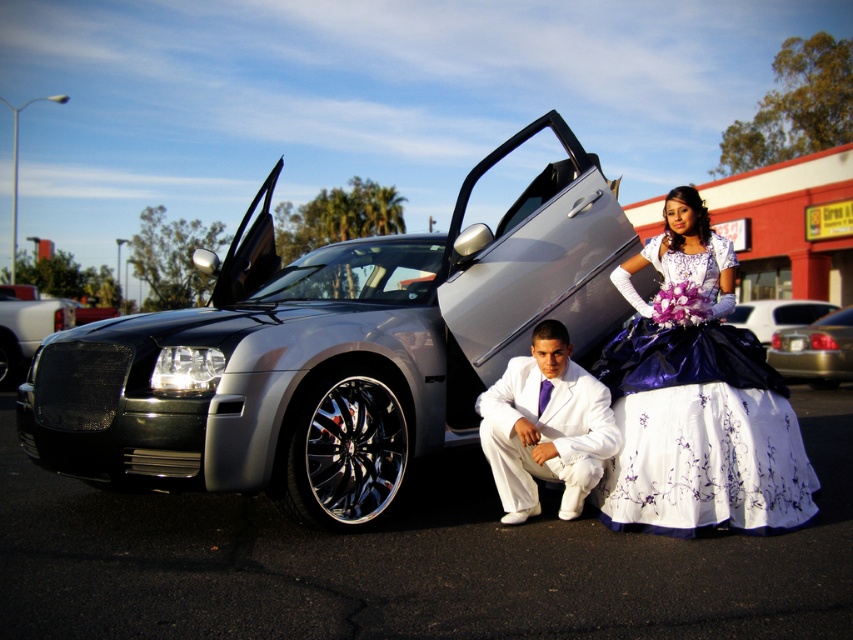
Which is in front, point (550, 352) or point (749, 316)?

Point (550, 352) is more forward.

At what (x,y) coordinates should I click in order to perform the action: click on white satin suit at center. Please return your answer as a coordinate pair (x, y). The height and width of the screenshot is (640, 853). Looking at the image, I should click on (544, 426).

Image resolution: width=853 pixels, height=640 pixels. I want to click on white satin suit at center, so click(x=544, y=426).

Which of these two, shiny chrome grille at center or silver metallic sedan at center, stands taller?

With more height is shiny chrome grille at center.

Who is more forward, [24,316] or [762,333]?

Point [24,316]

Locate an element on the screen. shiny chrome grille at center is located at coordinates (33, 324).

Is matte purple satin dress at right closer to the viewer compared to silver metallic sedan at lower right?

Yes, it is in front of silver metallic sedan at lower right.

Between point (642, 397) and point (834, 378), which one is positioned behind?

The point (834, 378) is behind.

This screenshot has width=853, height=640. I want to click on matte purple satin dress at right, so click(701, 436).